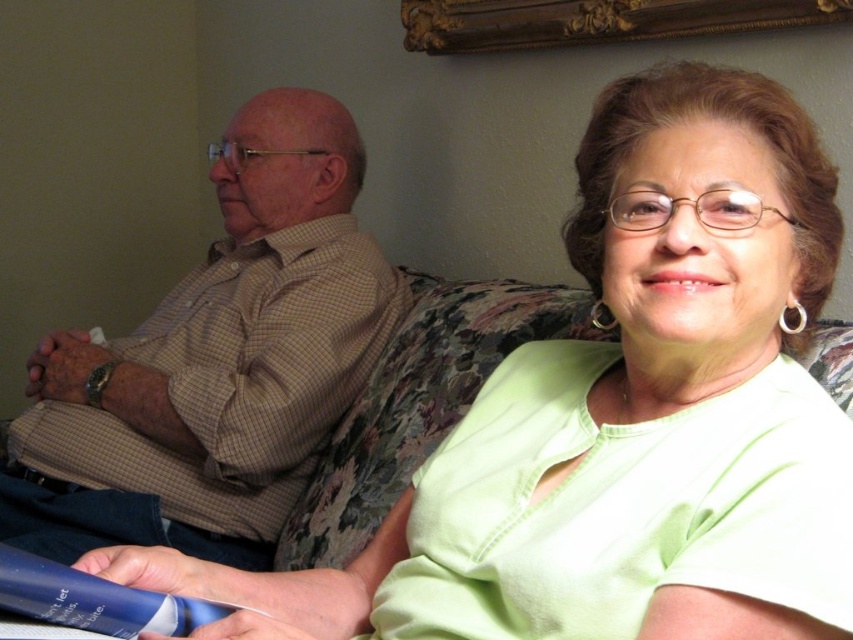
Question: Is brown checkered shirt at left in front of blue plastic tube at lower left?

Choices:
 (A) no
 (B) yes

Answer: (A)

Question: Which object appears farthest from the camera in this image?

Choices:
 (A) brown checkered shirt at left
 (B) gold ornate picture frame at upper center
 (C) blue plastic tube at lower left

Answer: (A)

Question: Is brown checkered shirt at left bigger than gold ornate picture frame at upper center?

Choices:
 (A) no
 (B) yes

Answer: (B)

Question: Is gold ornate picture frame at upper center positioned before blue plastic tube at lower left?

Choices:
 (A) no
 (B) yes

Answer: (A)

Question: Which point appears closest to the camera in this image?

Choices:
 (A) (105, 600)
 (B) (90, 461)
 (C) (445, 6)

Answer: (A)

Question: Considering the real-world distances, which object is closest to the gold ornate picture frame at upper center?

Choices:
 (A) blue plastic tube at lower left
 (B) brown checkered shirt at left

Answer: (B)